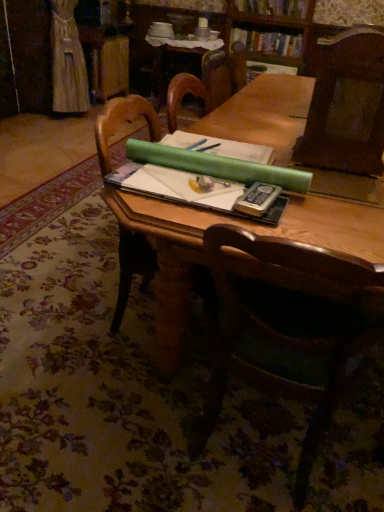
Question: From a real-world perspective, is wooden table at center located higher than green matte paper at center?

Choices:
 (A) yes
 (B) no

Answer: (A)

Question: Could you tell me if wooden table at center is turned towards green matte paper at center?

Choices:
 (A) yes
 (B) no

Answer: (B)

Question: Would you say wooden table at center contains green matte paper at center?

Choices:
 (A) no
 (B) yes

Answer: (A)

Question: Is wooden table at center not near green matte paper at center?

Choices:
 (A) yes
 (B) no

Answer: (B)

Question: Is wooden table at center at the left side of green matte paper at center?

Choices:
 (A) yes
 (B) no

Answer: (A)

Question: Is point (301, 1) closer or farther from the camera than point (281, 236)?

Choices:
 (A) farther
 (B) closer

Answer: (A)

Question: Is hardcover book at upper center, positioned as the 2th book in bottom-to-top order, in front of or behind wooden table at center in the image?

Choices:
 (A) behind
 (B) front

Answer: (A)

Question: In terms of height, does hardcover book at upper center, acting as the 1th book starting from the top, look taller or shorter compared to wooden table at center?

Choices:
 (A) short
 (B) tall

Answer: (A)

Question: Would you say hardcover book at upper center, acting as the 1th book starting from the top, is inside or outside wooden table at center?

Choices:
 (A) outside
 (B) inside

Answer: (A)

Question: From a real-world perspective, is hardcover book at upper center, positioned as the 2th book in bottom-to-top order, positioned above or below wooden chair at center, which appears as the 1th chair when ordered from the bottom?

Choices:
 (A) above
 (B) below

Answer: (A)

Question: Considering the relative positions of hardcover book at upper center, positioned as the 2th book in bottom-to-top order, and wooden chair at center, which appears as the 1th chair when ordered from the bottom, in the image provided, is hardcover book at upper center, positioned as the 2th book in bottom-to-top order, to the left or to the right of wooden chair at center, which appears as the 1th chair when ordered from the bottom,?

Choices:
 (A) left
 (B) right

Answer: (B)

Question: Looking at the image, does hardcover book at upper center, positioned as the 2th book in bottom-to-top order, seem bigger or smaller compared to wooden chair at center, which appears as the 1th chair when ordered from the bottom?

Choices:
 (A) small
 (B) big

Answer: (A)

Question: In the image, is hardcover book at upper center, positioned as the 2th book in bottom-to-top order, positioned in front of or behind wooden chair at center, arranged as the 2th chair when viewed from the top?

Choices:
 (A) behind
 (B) front

Answer: (A)

Question: In terms of size, does hardcover book at center appear bigger or smaller than hardcover book at upper center, which is counted as the 2th book, starting from the top?

Choices:
 (A) small
 (B) big

Answer: (A)

Question: From the image's perspective, is hardcover book at center located above or below hardcover book at upper center, the 1th book when ordered from bottom to top?

Choices:
 (A) above
 (B) below

Answer: (B)